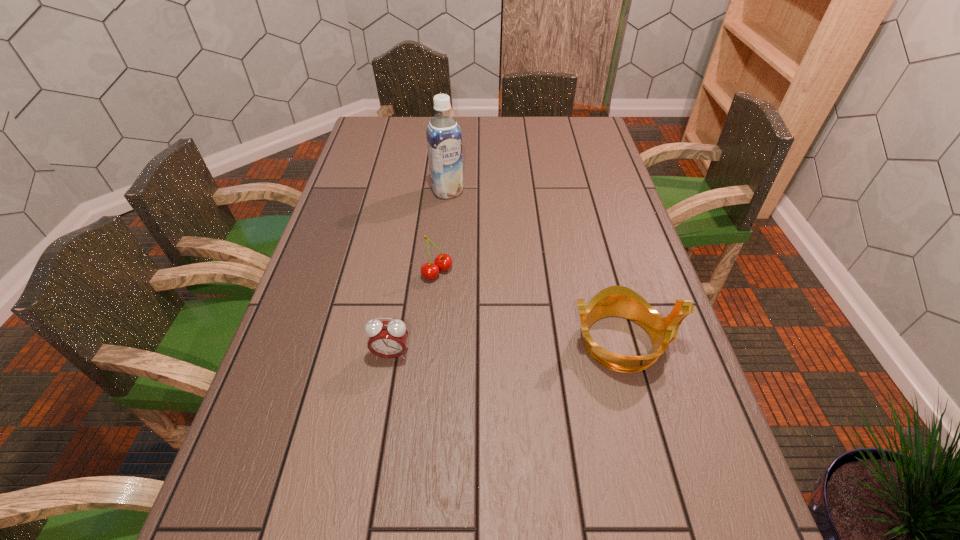
Identify the location of alarm clock. The width and height of the screenshot is (960, 540). (387, 339).

You are a GUI agent. You are given a task and a screenshot of the screen. Output one action in this format:
    pyautogui.click(x=<x>, y=<y>)
    Task: Click on the rightmost object
    This screenshot has height=540, width=960.
    Given the screenshot: What is the action you would take?
    pyautogui.click(x=620, y=301)

At what (x,y) coordinates should I click in order to perform the action: click on the farthest object. Please return your answer as a coordinate pair (x, y). This screenshot has width=960, height=540. Looking at the image, I should click on (444, 140).

You are a GUI agent. You are given a task and a screenshot of the screen. Output one action in this format:
    pyautogui.click(x=<x>, y=<y>)
    Task: Click on the tallest object
    The image size is (960, 540).
    Given the screenshot: What is the action you would take?
    pyautogui.click(x=444, y=140)

The width and height of the screenshot is (960, 540). What are the coordinates of `the third nearest object` in the screenshot? It's located at (443, 262).

Where is `free spot located 0.130m on the clock face of the alarm clock`? free spot located 0.130m on the clock face of the alarm clock is located at coordinates (381, 416).

In order to click on free space located on the label of the soya milk in this screenshot , I will do `click(463, 217)`.

You are a GUI agent. You are given a task and a screenshot of the screen. Output one action in this format:
    pyautogui.click(x=<x>, y=<y>)
    Task: Click on the free space located on the label of the soya milk
    The width and height of the screenshot is (960, 540).
    Given the screenshot: What is the action you would take?
    point(466,222)

Find the location of a particular element. This screenshot has width=960, height=540. free spot located 0.100m on the label of the soya milk is located at coordinates (464, 218).

What are the coordinates of `vacant space situated 0.110m with the stems of the cherry pointing upwards` in the screenshot? It's located at (478, 302).